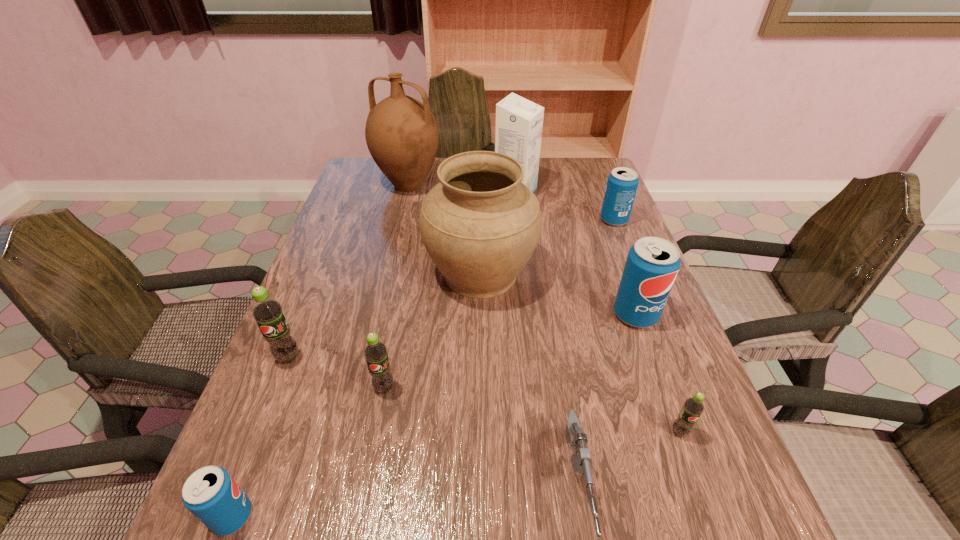
Where is `vacant point located on the front label of the leftmost green soda`? vacant point located on the front label of the leftmost green soda is located at coordinates (233, 495).

This screenshot has width=960, height=540. I want to click on vacant space situated on the front label of the second farthest green soda, so click(368, 476).

Find the location of a particular element. The height and width of the screenshot is (540, 960). free location located on the left of the farthest soda can is located at coordinates (569, 220).

The image size is (960, 540). What are the coordinates of `blank space located 0.130m on the front label of the nearest green soda` in the screenshot? It's located at (711, 519).

Where is `vacant area situated 0.190m on the right of the smallest blue soda can`? The width and height of the screenshot is (960, 540). vacant area situated 0.190m on the right of the smallest blue soda can is located at coordinates (373, 516).

Identify the location of pitcher present at the far edge. The width and height of the screenshot is (960, 540). (401, 133).

This screenshot has width=960, height=540. Find the location of `carton located at the far edge`. carton located at the far edge is located at coordinates (519, 122).

The width and height of the screenshot is (960, 540). Identify the location of object situated at the near edge. (211, 494).

This screenshot has width=960, height=540. Find the location of `pitcher at the left edge`. pitcher at the left edge is located at coordinates [x=401, y=133].

This screenshot has width=960, height=540. I want to click on object located in the far left corner section of the desktop, so click(x=401, y=133).